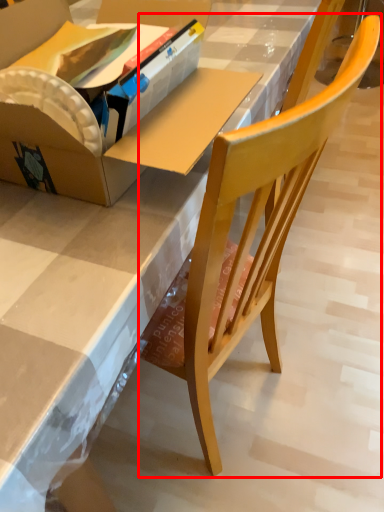
Question: In this image, where is chair (annotated by the red box) located relative to box?

Choices:
 (A) right
 (B) left

Answer: (A)